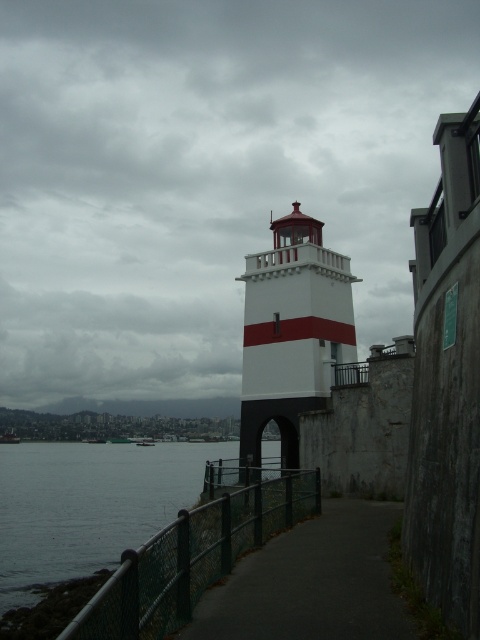
Is dark gray asphalt at center wider than white painted concrete lighthouse at center?

No.

Between dark gray asphalt at center and white painted concrete lighthouse at center, which one is positioned higher?

white painted concrete lighthouse at center is above.

Is point (384, 536) more distant than point (241, 412)?

No, (384, 536) is closer to viewer.

Identify the location of dark gray asphalt at center. The height and width of the screenshot is (640, 480). (312, 582).

Locate an element on the screen. white painted concrete lighthouse at center is located at coordinates (291, 332).

Between dark gray asphalt at center and green chain-link fence at lower center, which one has less height?

With less height is dark gray asphalt at center.

Is dark gray asphalt at center below green chain-link fence at lower center?

Incorrect, dark gray asphalt at center is not positioned below green chain-link fence at lower center.

The height and width of the screenshot is (640, 480). In order to click on dark gray asphalt at center in this screenshot , I will do `click(312, 582)`.

The image size is (480, 640). Find the location of `dark gray asphalt at center`. dark gray asphalt at center is located at coordinates point(312,582).